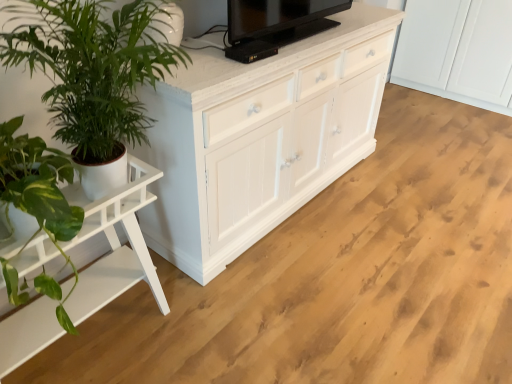
Question: Does white wood table at left have a lesser height compared to green leafy plant at left?

Choices:
 (A) no
 (B) yes

Answer: (A)

Question: Can you confirm if white wood table at left is taller than green leafy plant at left?

Choices:
 (A) yes
 (B) no

Answer: (A)

Question: Is white wood table at left directly adjacent to green leafy plant at left?

Choices:
 (A) yes
 (B) no

Answer: (B)

Question: Can you confirm if white wood table at left is wider than green leafy plant at left?

Choices:
 (A) yes
 (B) no

Answer: (B)

Question: Would you say green leafy plant at left is part of white wood table at left's contents?

Choices:
 (A) yes
 (B) no

Answer: (B)

Question: Considering the relative positions of white wood table at left and green leafy plant at left in the image provided, is white wood table at left to the left of green leafy plant at left from the viewer's perspective?

Choices:
 (A) no
 (B) yes

Answer: (B)

Question: Is green leafy plant at left not near white wood table at left?

Choices:
 (A) yes
 (B) no

Answer: (B)

Question: Does green leafy plant at left have a larger size compared to white wood table at left?

Choices:
 (A) no
 (B) yes

Answer: (A)

Question: Is white wood table at left located within green leafy plant at left?

Choices:
 (A) yes
 (B) no

Answer: (B)

Question: From the image's perspective, would you say green leafy plant at left is positioned over white wood table at left?

Choices:
 (A) yes
 (B) no

Answer: (A)

Question: Considering the relative sizes of green leafy plant at left and white wood table at left in the image provided, is green leafy plant at left taller than white wood table at left?

Choices:
 (A) yes
 (B) no

Answer: (B)

Question: Is green leafy plant at left completely or partially outside of white wood table at left?

Choices:
 (A) yes
 (B) no

Answer: (A)

Question: Can you confirm if white wood table at left is taller than black glossy tv at upper center?

Choices:
 (A) no
 (B) yes

Answer: (B)